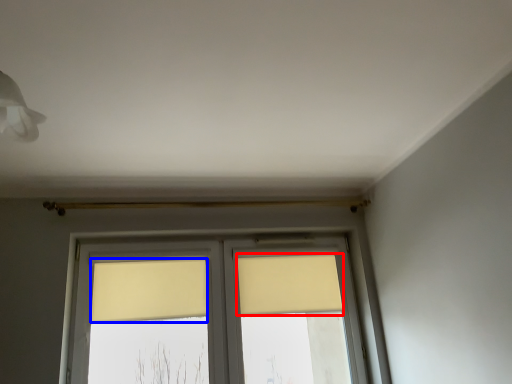
Question: Which object appears farthest to the camera in this image, curtain (highlighted by a red box) or curtain (highlighted by a blue box)?

Choices:
 (A) curtain
 (B) curtain

Answer: (A)